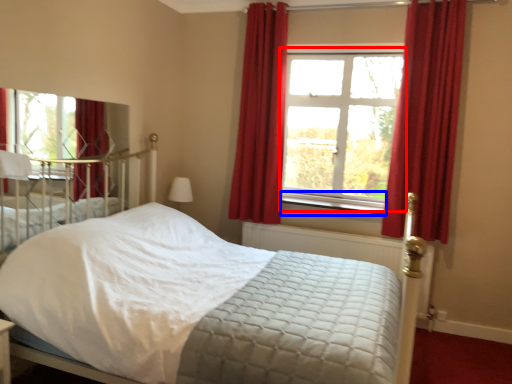
Question: Which object is further to the camera taking this photo, window (highlighted by a red box) or window sill (highlighted by a blue box)?

Choices:
 (A) window
 (B) window sill

Answer: (A)